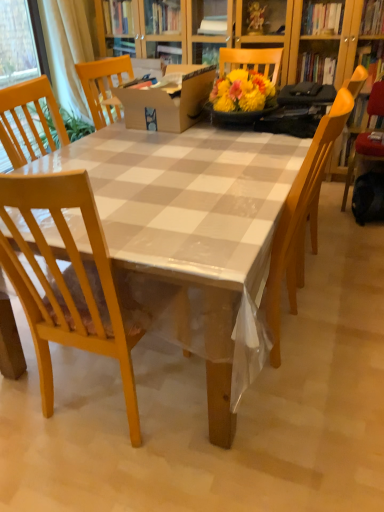
Locate an element on the screen. cardboard box at center is located at coordinates coord(168,101).

Measure the distance between wooden chair at center, placed as the 2th chair when sorted from back to front, and camera.

4.23 feet.

This screenshot has width=384, height=512. Identify the location of cardboard box at center. (168, 101).

Considering the sizes of objects white sheer curtain at upper left and wooden chair at center, which appears as the second chair when viewed from the left, in the image provided, who is shorter, white sheer curtain at upper left or wooden chair at center, which appears as the second chair when viewed from the left,?

white sheer curtain at upper left.

Which object is more forward, white sheer curtain at upper left or wooden chair at center, which appears as the second chair when viewed from the right?

wooden chair at center, which appears as the second chair when viewed from the right, is more forward.

Is there a large distance between white sheer curtain at upper left and wooden chair at center, which appears as the second chair when viewed from the right?

Yes, white sheer curtain at upper left and wooden chair at center, which appears as the second chair when viewed from the right, are quite far apart.

Is white sheer curtain at upper left facing towards wooden chair at center, which appears as the second chair when viewed from the front?

No.

Are white sheer curtain at upper left and wooden table at center beside each other?

No, white sheer curtain at upper left is not with wooden table at center.

Considering the sizes of objects white sheer curtain at upper left and wooden table at center in the image provided, who is bigger, white sheer curtain at upper left or wooden table at center?

Bigger between the two is wooden table at center.

Between point (81, 89) and point (241, 355), which one is positioned in front?

Positioned in front is point (241, 355).

Is wooden table at center positioned beyond the bounds of yellow wood chair at right, the 3th chair when ordered from left to right?

Indeed, wooden table at center is completely outside yellow wood chair at right, the 3th chair when ordered from left to right.

Considering the positions of objects wooden table at center and yellow wood chair at right, placed as the first chair when sorted from right to left, in the image provided, who is in front, wooden table at center or yellow wood chair at right, placed as the first chair when sorted from right to left,?

wooden table at center is more forward.

Is wooden table at center looking in the opposite direction of yellow wood chair at right, which appears as the 1th chair when viewed from the back?

wooden table at center is not turned away from yellow wood chair at right, which appears as the 1th chair when viewed from the back.

Find the location of a particular element. Image resolution: width=384 pixels, height=512 pixels. kitchen & dining room table that appears below the yellow wood chair at right, the 3th chair when ordered from left to right (from the image's perspective) is located at coordinates (192, 233).

Who is taller, white sheer curtain at upper left or cardboard box at center?

white sheer curtain at upper left.

Could you tell me if white sheer curtain at upper left is turned towards cardboard box at center?

No, white sheer curtain at upper left is not aimed at cardboard box at center.

Between white sheer curtain at upper left and cardboard box at center, which one is positioned behind?

white sheer curtain at upper left is further away from the camera.

How many degrees apart are the facing directions of white sheer curtain at upper left and cardboard box at center?

The facing directions of white sheer curtain at upper left and cardboard box at center are 85.9 degrees apart.

From a real-world perspective, who is located higher, wooden table at center or wooden chair at center, placed as the 2th chair when sorted from back to front?

wooden chair at center, placed as the 2th chair when sorted from back to front, from a real-world perspective.

Which object is positioned more to the left, wooden table at center or wooden chair at center, which appears as the second chair when viewed from the right?

wooden table at center.

From the image's perspective, which one is positioned lower, wooden table at center or wooden chair at center, which appears as the second chair when viewed from the left?

From the image's view, wooden chair at center, which appears as the second chair when viewed from the left, is below.

Is wooden table at center positioned before wooden chair at center, which appears as the second chair when viewed from the right?

Yes, it is.

Which is correct: cardboard box at center is inside wooden table at center, or outside of it?

cardboard box at center is not enclosed by wooden table at center.

Where is `kitchen & dining room table that is under the cardboard box at center (from a real-world perspective)`? The width and height of the screenshot is (384, 512). kitchen & dining room table that is under the cardboard box at center (from a real-world perspective) is located at coordinates (192, 233).

What's the angular difference between cardboard box at center and wooden table at center's facing directions?

They differ by 89.9 degrees in their facing directions.

How much distance is there between cardboard box at center and wooden table at center?

cardboard box at center and wooden table at center are 58.61 centimeters apart from each other.

Consider the image. Is light wood chair at left, positioned as the third chair in right-to-left order, to the left or to the right of wooden chair at center, which appears as the second chair when viewed from the left, in the image?

light wood chair at left, positioned as the third chair in right-to-left order, is positioned on wooden chair at center, which appears as the second chair when viewed from the left,'s left side.

Is light wood chair at left, arranged as the 1th chair when viewed from the left, oriented towards wooden chair at center, which appears as the second chair when viewed from the left?

No, light wood chair at left, arranged as the 1th chair when viewed from the left, is not turned towards wooden chair at center, which appears as the second chair when viewed from the left.

Considering the sizes of objects light wood chair at left, positioned as the third chair in right-to-left order, and wooden chair at center, which appears as the second chair when viewed from the left, in the image provided, who is thinner, light wood chair at left, positioned as the third chair in right-to-left order, or wooden chair at center, which appears as the second chair when viewed from the left,?

Thinner between the two is wooden chair at center, which appears as the second chair when viewed from the left.

Locate an element on the screen. the 2nd chair below the white sheer curtain at upper left (from the image's perspective) is located at coordinates (301, 218).

Find the location of `curtain above the wooden table at center (from the image's perspective)`. curtain above the wooden table at center (from the image's perspective) is located at coordinates (67, 50).

Which object lies further to the anchor point light wood chair at left, positioned as the first chair in front-to-back order, white sheer curtain at upper left or wooden table at center?

white sheer curtain at upper left.

Considering their positions, is light wood chair at left, the third chair when ordered from back to front, positioned further to white sheer curtain at upper left than cardboard box at center?

The object further to white sheer curtain at upper left is light wood chair at left, the third chair when ordered from back to front.

From the picture: Based on their spatial positions, is wooden table at center or white sheer curtain at upper left closer to cardboard box at center?

wooden table at center is closer to cardboard box at center.

When comparing their distances from cardboard box at center, does wooden chair at center, which appears as the second chair when viewed from the left, or white sheer curtain at upper left seem closer?

The object closer to cardboard box at center is wooden chair at center, which appears as the second chair when viewed from the left.

When comparing their distances from yellow wood chair at right, the third chair in the front-to-back sequence, does light wood chair at left, positioned as the first chair in front-to-back order, or cardboard box at center seem closer?

Among the two, cardboard box at center is located nearer to yellow wood chair at right, the third chair in the front-to-back sequence.

Considering their positions, is wooden table at center positioned closer to white sheer curtain at upper left than cardboard box at center?

cardboard box at center.

Which object lies further to the anchor point wooden chair at center, which appears as the second chair when viewed from the right, yellow wood chair at right, the third chair in the front-to-back sequence, or wooden table at center?

Among the two, yellow wood chair at right, the third chair in the front-to-back sequence, is located further to wooden chair at center, which appears as the second chair when viewed from the right.

Estimate the real-world distances between objects in this image. Which object is further from wooden table at center, wooden chair at center, which appears as the second chair when viewed from the front, or light wood chair at left, positioned as the first chair in front-to-back order?

Based on the image, wooden chair at center, which appears as the second chair when viewed from the front, appears to be further to wooden table at center.

In order to click on kitchen & dining room table between light wood chair at left, positioned as the first chair in front-to-back order, and white sheer curtain at upper left in the front-back direction in this screenshot , I will do `click(192, 233)`.

You are a GUI agent. You are given a task and a screenshot of the screen. Output one action in this format:
    pyautogui.click(x=<x>, y=<y>)
    Task: Click on the box between light wood chair at left, positioned as the third chair in right-to-left order, and yellow wood chair at right, the third chair in the front-to-back sequence, in the horizontal direction
    Image resolution: width=384 pixels, height=512 pixels.
    Given the screenshot: What is the action you would take?
    pyautogui.click(x=168, y=101)

The image size is (384, 512). I want to click on box between wooden table at center and white sheer curtain at upper left in the front-back direction, so click(168, 101).

Locate an element on the screen. The image size is (384, 512). chair between light wood chair at left, the third chair when ordered from back to front, and yellow wood chair at right, placed as the first chair when sorted from right to left, along the z-axis is located at coordinates (301, 218).